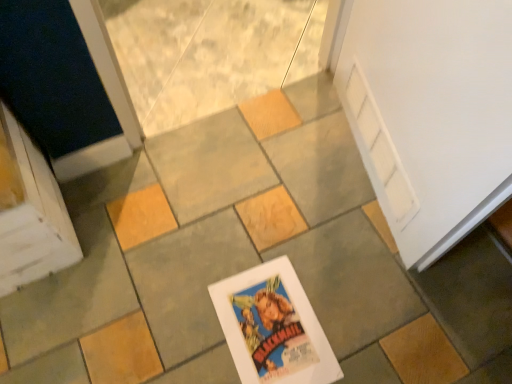
The height and width of the screenshot is (384, 512). I want to click on vacant area located to the right-hand side of white paper picture frame at center, so click(367, 314).